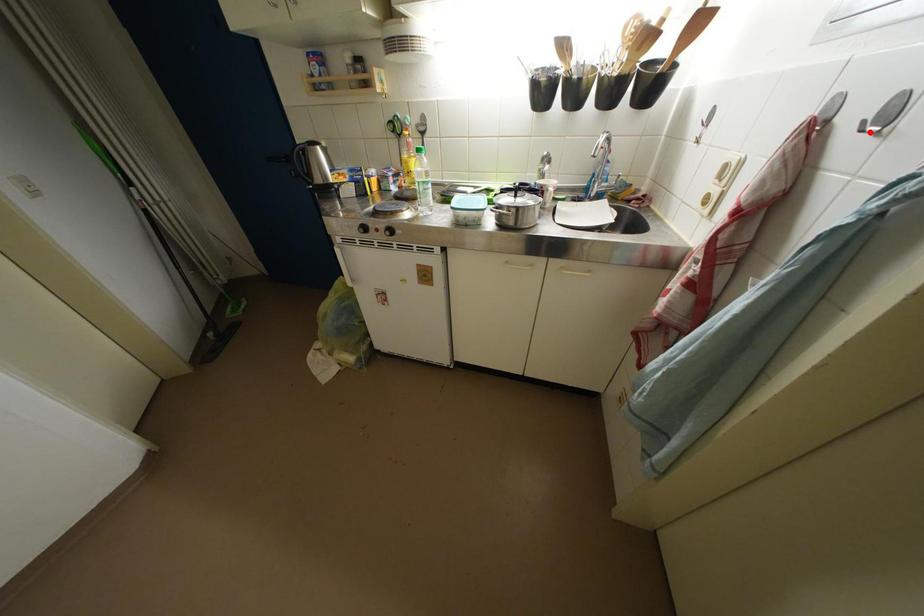
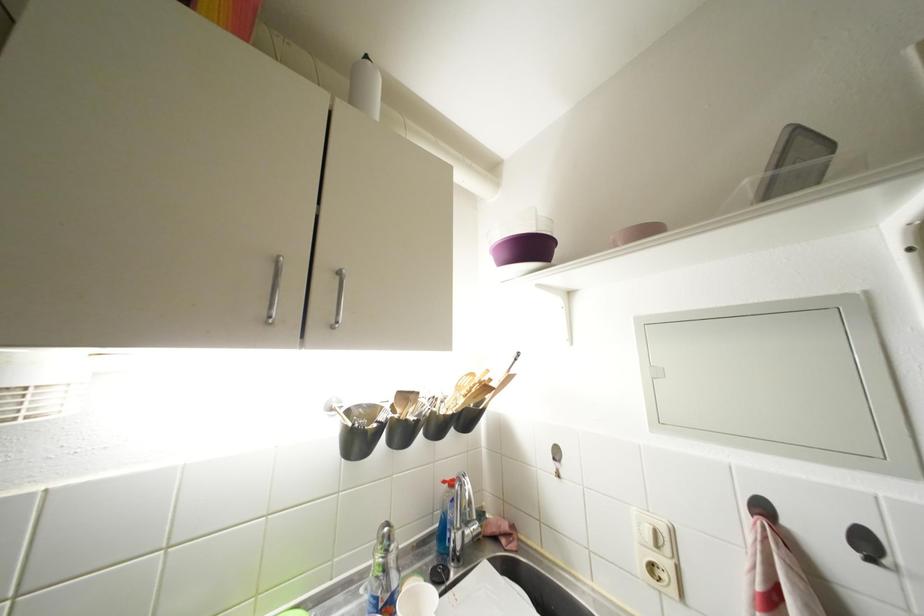
The point at the highlighted location is marked in the first image. Where is the corresponding point in the second image?

(877, 565)